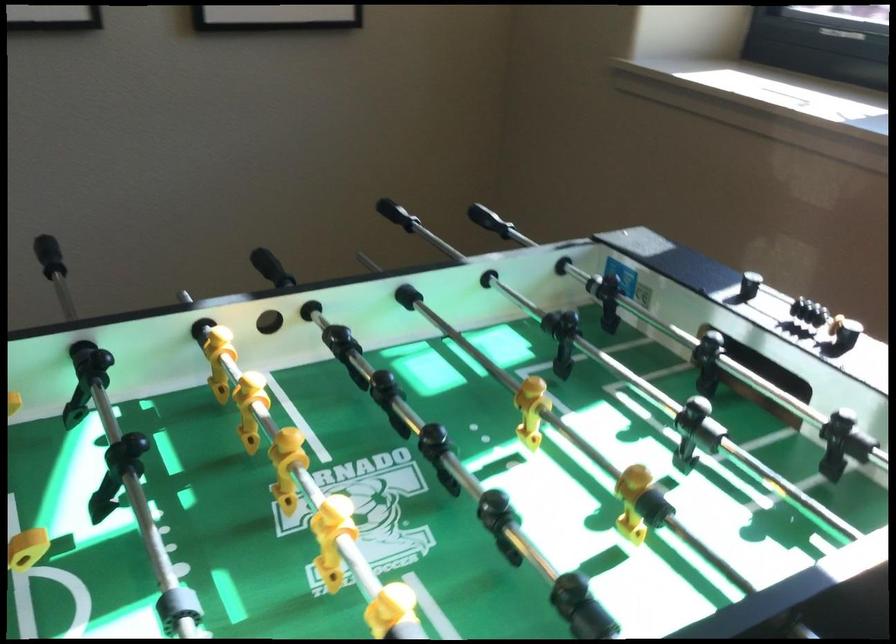
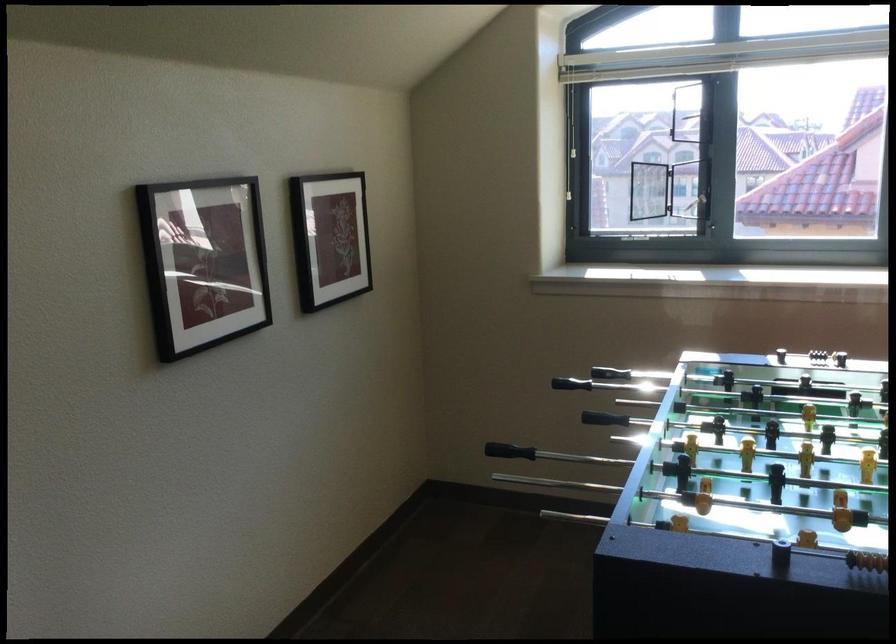
Where in the second image is the point corresponding to (x=819, y=315) from the first image?

(815, 351)